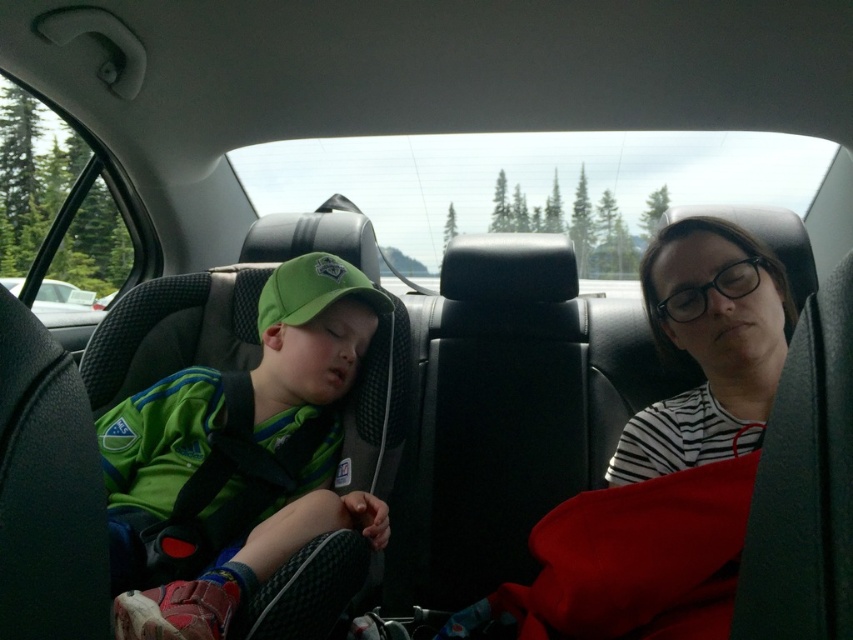
Question: Which of the following is the closest to the observer?

Choices:
 (A) white glossy car at left
 (B) white striped shirt at upper right

Answer: (B)

Question: Which point appears closest to the camera in this image?

Choices:
 (A) (64, 292)
 (B) (199, 536)

Answer: (B)

Question: Does white striped shirt at upper right appear over white glossy car at left?

Choices:
 (A) yes
 (B) no

Answer: (B)

Question: Does white striped shirt at upper right appear on the left side of white glossy car at left?

Choices:
 (A) yes
 (B) no

Answer: (B)

Question: Which of the following is the farthest from the observer?

Choices:
 (A) white glossy car at left
 (B) green matte baseball cap at left

Answer: (A)

Question: Where is green matte baseball cap at left located in relation to white striped shirt at upper right in the image?

Choices:
 (A) right
 (B) left

Answer: (B)